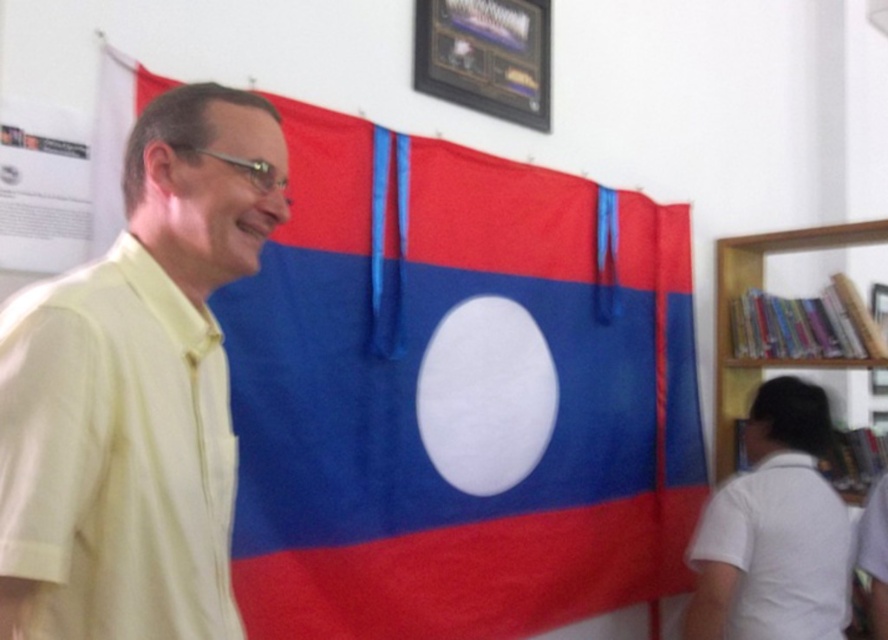
You are an interior designer observing the scene. You need to hang a new picture between the yellow cotton shirt at left and the metallic framed certificate at upper center. Based on their positions, where should you place the new picture?

The yellow cotton shirt at left is below the metallic framed certificate at upper center, so the new picture should be placed between them, above the yellow cotton shirt at left and below the metallic framed certificate at upper center to maintain spatial order.

You are a photographer setting up for a portrait. You need to ensure that both the yellow cotton shirt at left and the metallic framed certificate at upper center are in focus. Given that your camera has a depth of field that can cover 1.2 meters, will both objects be in focus?

The yellow cotton shirt at left and the metallic framed certificate at upper center are 1.30 meters apart. Since the camera can only cover 1.2 meters, they are slightly out of the depth of field range, so both might not be fully in focus.

You are standing in the room and see the point marked at coordinates (457, 394). Based on the scene description, can you determine what object this point is located on?

The point at coordinates (457, 394) is on the textured fabric flag at center.